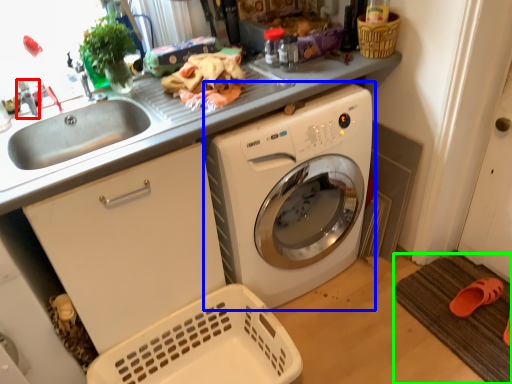
Question: Which object is positioned closest to faucet (highlighted by a red box)? Select from washing machine (highlighted by a blue box) and bath mat (highlighted by a green box).

Choices:
 (A) washing machine
 (B) bath mat

Answer: (A)